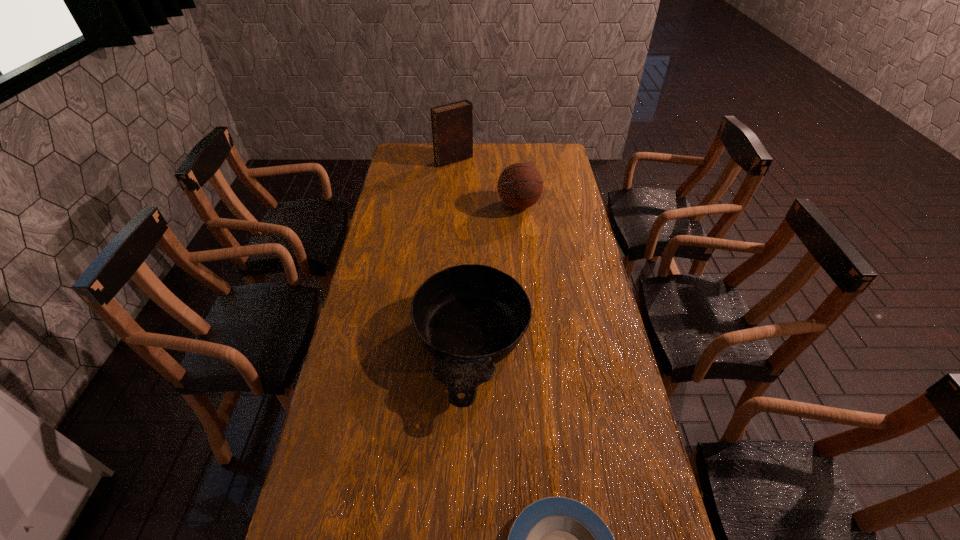
You are a GUI agent. You are given a task and a screenshot of the screen. Output one action in this format:
    pyautogui.click(x=<x>, y=<y>)
    Task: Click on the object positioned at the right edge
    This screenshot has width=960, height=540.
    Given the screenshot: What is the action you would take?
    pyautogui.click(x=520, y=185)

In the image, there is a desktop. Where is `free space at the far edge`? free space at the far edge is located at coordinates (503, 163).

Where is `free location at the left edge of the desktop`? free location at the left edge of the desktop is located at coordinates (344, 525).

The width and height of the screenshot is (960, 540). In the image, there is a desktop. Find the location of `vacant region at the right edge`. vacant region at the right edge is located at coordinates (574, 256).

In the image, there is a desktop. Where is `vacant space at the far left corner`? This screenshot has height=540, width=960. vacant space at the far left corner is located at coordinates (397, 165).

Where is `blank space at the far right corner of the desktop`? blank space at the far right corner of the desktop is located at coordinates (557, 146).

This screenshot has height=540, width=960. I want to click on unoccupied area between the third shortest object and the Bible, so click(487, 182).

At what (x,y) coordinates should I click in order to perform the action: click on blank region between the frying pan and the Bible. Please return your answer as a coordinate pair (x, y). This screenshot has width=960, height=540. Looking at the image, I should click on (463, 254).

I want to click on free point between the tallest object and the third nearest object, so click(x=487, y=182).

Image resolution: width=960 pixels, height=540 pixels. Identify the location of unoccupied area between the basketball and the farthest object. (487, 182).